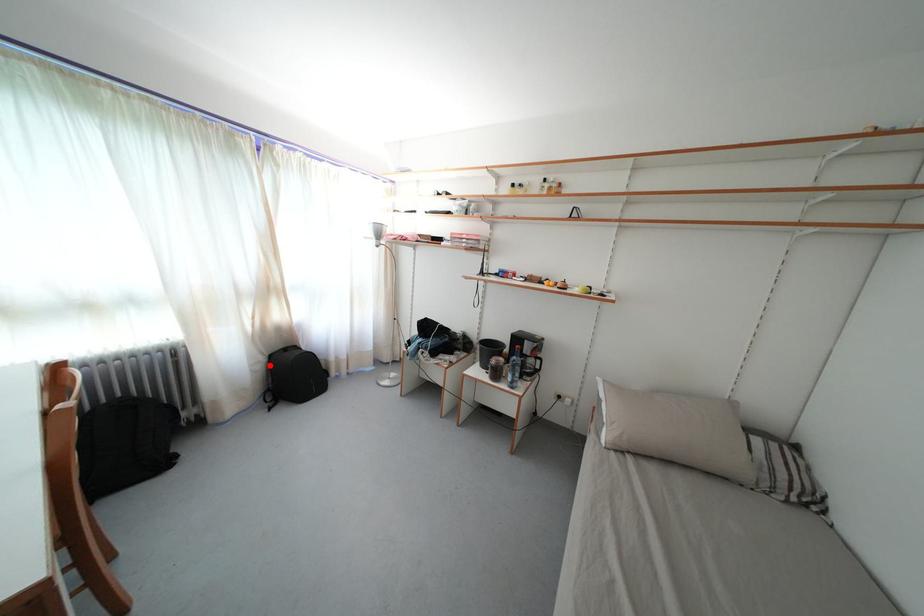
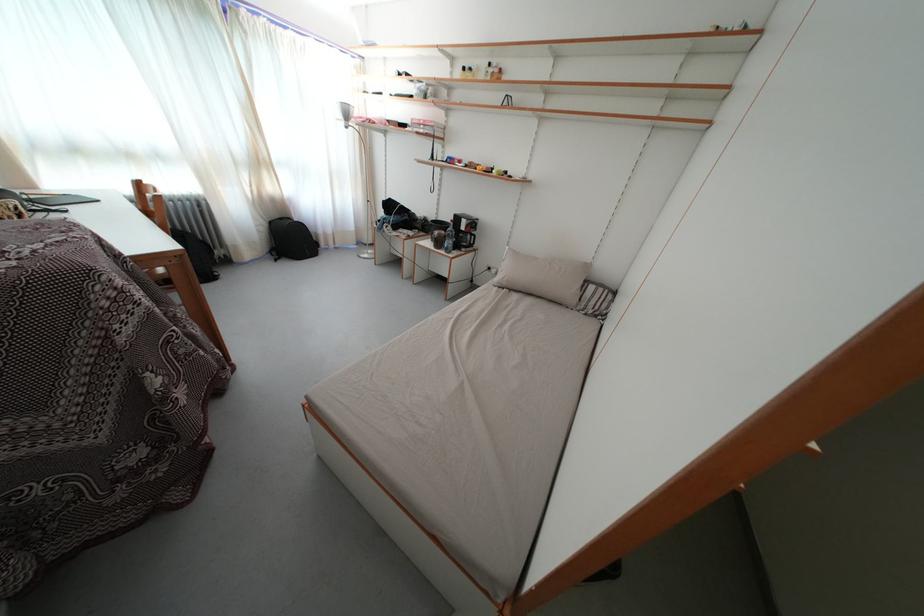
The point at the highlighted location is marked in the first image. Where is the corresponding point in the second image?

(272, 230)